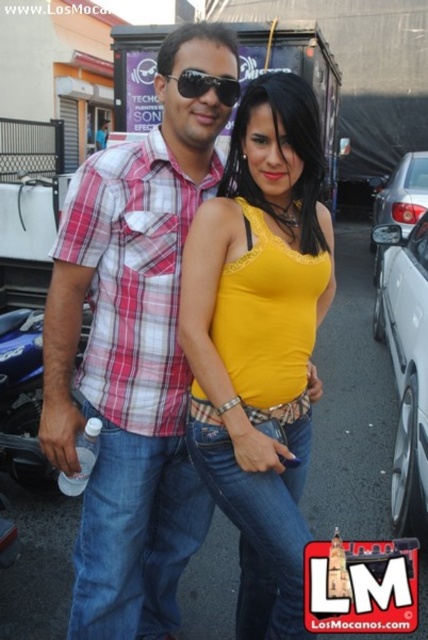
Question: Can you confirm if plaid shirt at center is positioned above blue metallic motorcycle at lower left?

Choices:
 (A) no
 (B) yes

Answer: (B)

Question: Which object appears closest to the camera in this image?

Choices:
 (A) blue metallic motorcycle at lower left
 (B) plaid shirt at center
 (C) white glossy car at right

Answer: (B)

Question: Can you confirm if plaid cotton shirt at center is thinner than black plastic sunglasses at upper center?

Choices:
 (A) no
 (B) yes

Answer: (A)

Question: Which of these objects is positioned closest to the silver metallic sedan at right?

Choices:
 (A) blue metallic motorcycle at lower left
 (B) yellow matte tank top at center
 (C) white glossy car at right

Answer: (C)

Question: Does plaid cotton shirt at center come behind white glossy car at right?

Choices:
 (A) no
 (B) yes

Answer: (A)

Question: Which point is closer to the camera taking this photo?

Choices:
 (A) (33, 381)
 (B) (422, 417)
 (C) (380, 208)

Answer: (B)